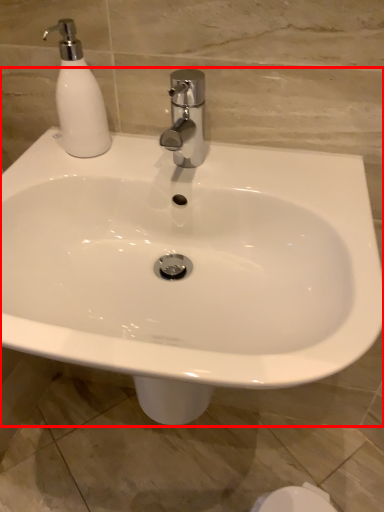
Question: Considering the relative positions of sink (annotated by the red box) and soap dispenser in the image provided, where is sink (annotated by the red box) located with respect to the staircase?

Choices:
 (A) left
 (B) right

Answer: (B)